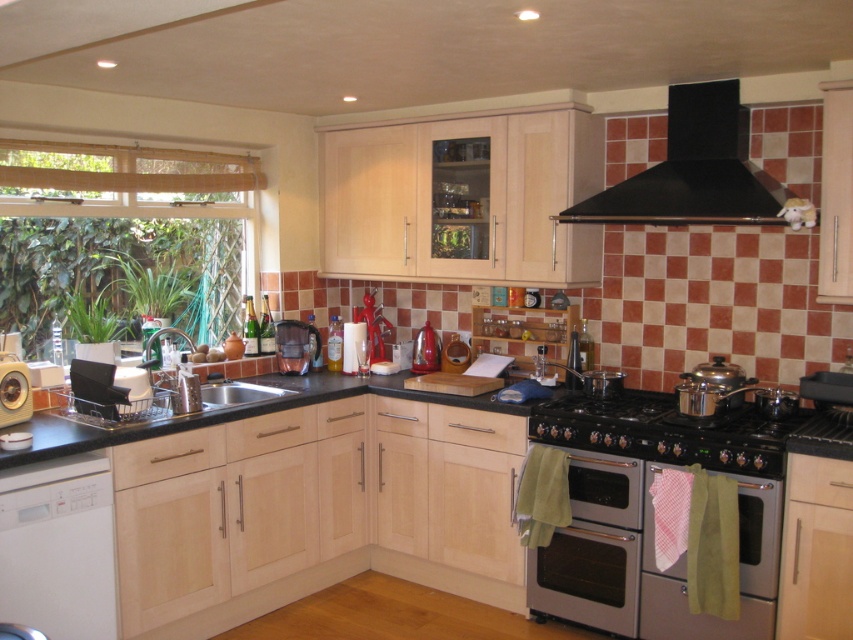
Question: Can you confirm if white matte dishwasher at lower left is positioned to the right of stainless steel stove at lower center?

Choices:
 (A) no
 (B) yes

Answer: (A)

Question: Is the position of wooden blinds at left less distant than that of silver/stainless steel oven at lower right?

Choices:
 (A) no
 (B) yes

Answer: (A)

Question: Among these points, which one is farthest from the camera?

Choices:
 (A) (581, 492)
 (B) (96, 236)
 (C) (659, 180)

Answer: (B)

Question: Which object is farther from the camera taking this photo?

Choices:
 (A) satin silver sink at center
 (B) stainless steel stove at lower center
 (C) satin silver pot at center-right

Answer: (A)

Question: Which point is closer to the camera?

Choices:
 (A) black matte exhaust hood at upper right
 (B) satin silver pot at center-right
 (C) stainless steel stove at lower center
 (D) matte silver washing machine at left

Answer: (C)

Question: Does wooden blinds at left have a greater width compared to matte plastic coffee maker at center?

Choices:
 (A) yes
 (B) no

Answer: (A)